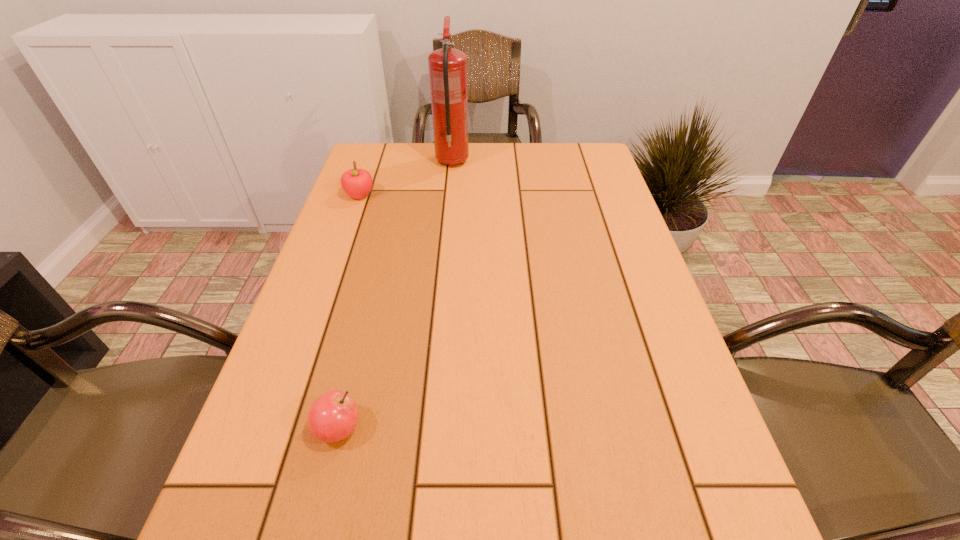
Where is `blank region between the nearest object and the farther apple`? Image resolution: width=960 pixels, height=540 pixels. blank region between the nearest object and the farther apple is located at coordinates (349, 312).

At what (x,y) coordinates should I click in order to perform the action: click on blank region between the leftmost object and the second object from left to right. Please return your answer as a coordinate pair (x, y). This screenshot has width=960, height=540. Looking at the image, I should click on (349, 312).

Find the location of a particular element. This screenshot has width=960, height=540. vacant space in between the tallest object and the shortest object is located at coordinates (396, 295).

Where is `free spot between the second object from left to right and the second farthest object`? free spot between the second object from left to right and the second farthest object is located at coordinates (349, 312).

Identify the location of the closest object relative to the taller apple. This screenshot has width=960, height=540. (x=447, y=67).

Where is `object that is the second closest to the rightmost object`? object that is the second closest to the rightmost object is located at coordinates (332, 417).